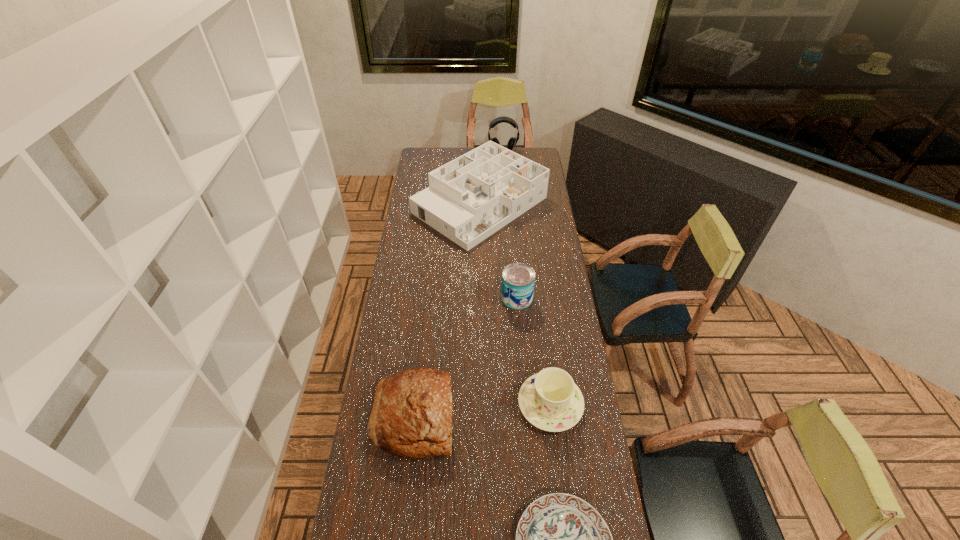
You are a GUI agent. You are given a task and a screenshot of the screen. Output one action in this format:
    pyautogui.click(x=<x>, y=<y>)
    Task: Click on the vacant region located 0.330m on the handle side of the chinaware
    This screenshot has width=960, height=540.
    Given the screenshot: What is the action you would take?
    pyautogui.click(x=423, y=404)

The width and height of the screenshot is (960, 540). Find the location of `vacant space located 0.170m on the handle side of the chinaware`. vacant space located 0.170m on the handle side of the chinaware is located at coordinates (469, 404).

Where is `blank area located on the handle side of the chinaware`? Image resolution: width=960 pixels, height=540 pixels. blank area located on the handle side of the chinaware is located at coordinates (441, 404).

Find the location of `earphone that is at the far edge`. earphone that is at the far edge is located at coordinates (512, 142).

Find the location of a particular element. This screenshot has height=540, width=960. dollhouse that is at the far edge is located at coordinates (468, 199).

In order to click on dollhouse present at the left edge in this screenshot , I will do `click(468, 199)`.

Identify the location of bread that is at the left edge. (411, 417).

Locate an element on the screen. earphone situated at the right edge is located at coordinates (512, 142).

You are a GUI agent. You are given a task and a screenshot of the screen. Output one action in this format:
    pyautogui.click(x=<x>, y=<y>)
    Task: Click on the dollhouse at the right edge
    Image resolution: width=960 pixels, height=540 pixels.
    Given the screenshot: What is the action you would take?
    pyautogui.click(x=468, y=199)

You are a GUI agent. You are given a task and a screenshot of the screen. Output one action in this format:
    pyautogui.click(x=<x>, y=<y>)
    Task: Click on the can that is at the right edge
    This screenshot has width=960, height=540.
    Given the screenshot: What is the action you would take?
    pyautogui.click(x=518, y=279)